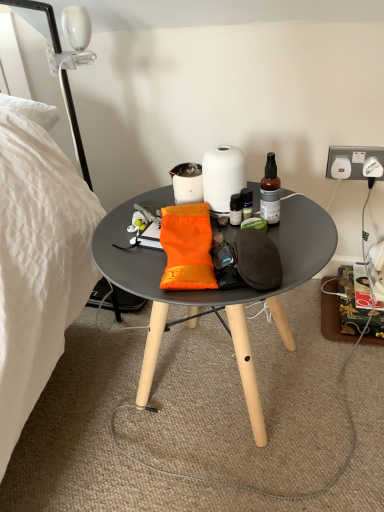
Find the location of `vacant point to the right of orange fabric pouch at center`. vacant point to the right of orange fabric pouch at center is located at coordinates point(294,243).